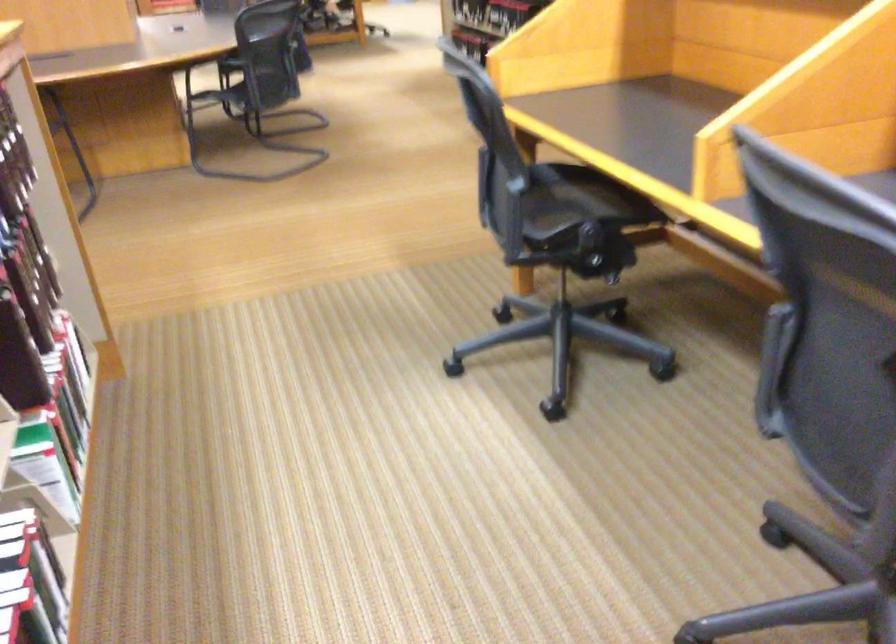
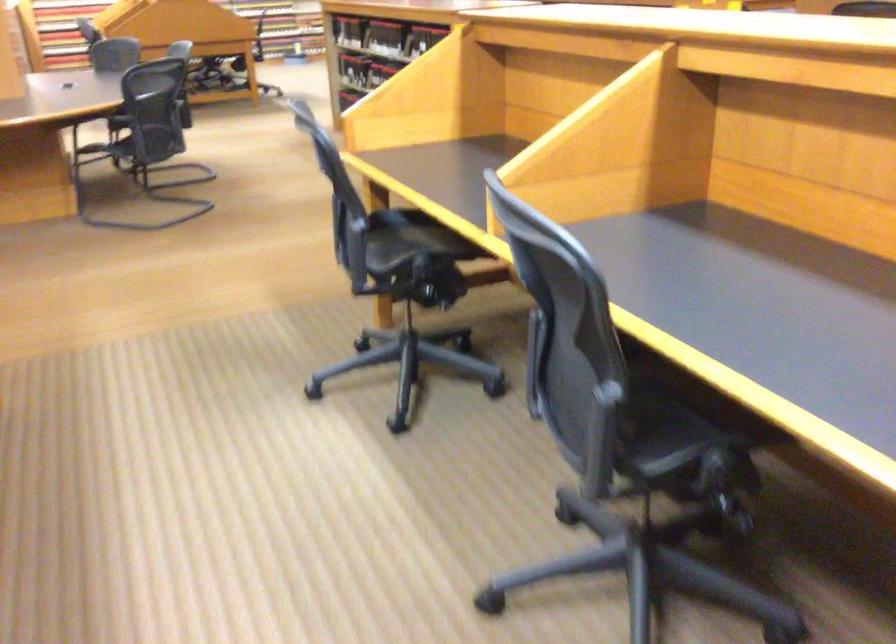
The point at (564, 196) is marked in the first image. Where is the corresponding point in the second image?

(409, 240)